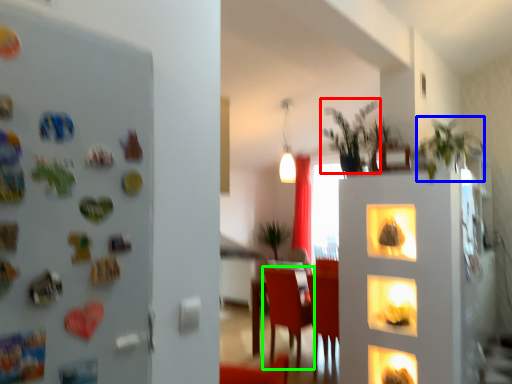
Question: Considering the real-world distances, which object is closest to plant (highlighted by a red box)? plant (highlighted by a blue box) or armchair (highlighted by a green box).

Choices:
 (A) plant
 (B) armchair

Answer: (A)